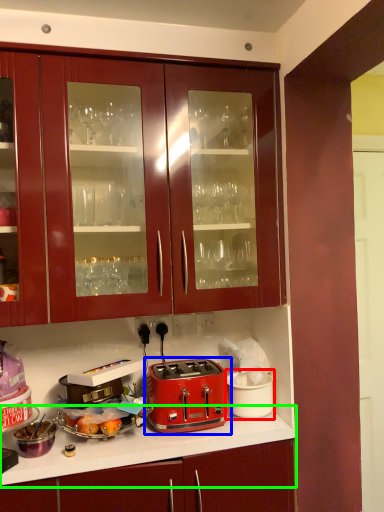
Question: Which is nearer to the appliance (highlighted by a red box)? toaster (highlighted by a blue box) or countertop (highlighted by a green box).

Choices:
 (A) toaster
 (B) countertop

Answer: (A)